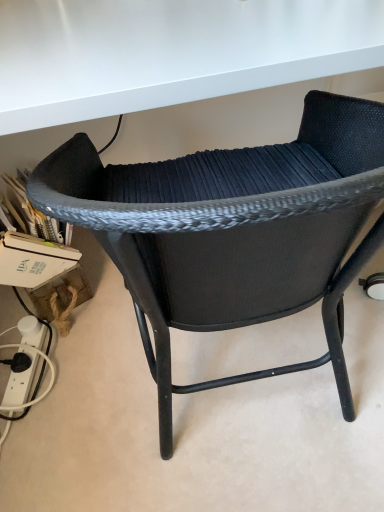
The width and height of the screenshot is (384, 512). What are the coordinates of `blank space situated above black woven chair at center (from a real-world perspective)` in the screenshot? It's located at (196, 49).